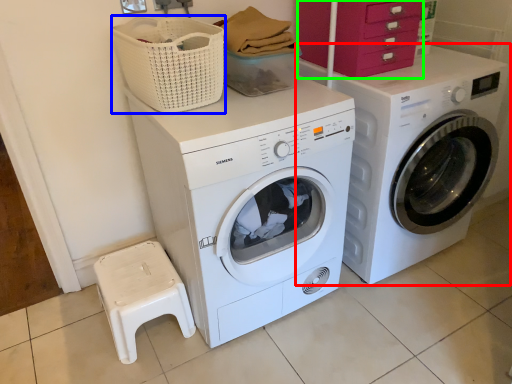
Question: Estimate the real-world distances between objects in this image. Which object is farther from washing machine (highlighted by a red box), basket (highlighted by a blue box) or drawer (highlighted by a green box)?

Choices:
 (A) basket
 (B) drawer

Answer: (A)